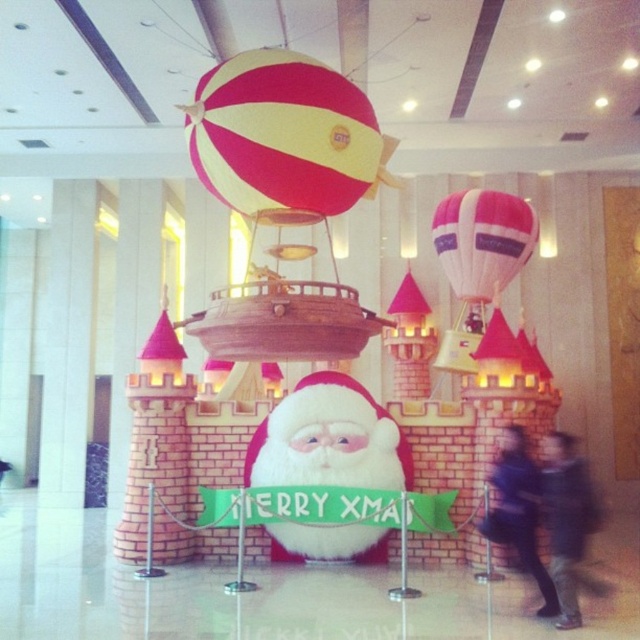
Question: Can you confirm if yellow and red striped balloon at upper center is positioned above pink fabric balloon at center?

Choices:
 (A) no
 (B) yes

Answer: (B)

Question: Which object is closer to the camera taking this photo?

Choices:
 (A) pink fabric balloon at center
 (B) dark blue fabric coat at lower right
 (C) fluffy white santa at center

Answer: (B)

Question: Does pink fabric balloon at center have a greater width compared to dark blue fabric coat at lower right?

Choices:
 (A) no
 (B) yes

Answer: (B)

Question: From the image, what is the correct spatial relationship of pink fabric balloon at center in relation to dark blue jacket at lower right?

Choices:
 (A) right
 (B) left

Answer: (A)

Question: Which point is farther to the camera?

Choices:
 (A) yellow and red striped balloon at upper center
 (B) fluffy white santa at center
 (C) dark blue fabric coat at lower right
 (D) dark blue jacket at lower right

Answer: (B)

Question: Considering the real-world distances, which object is farthest from the fluffy white santa at center?

Choices:
 (A) pink fabric balloon at center
 (B) yellow and red striped balloon at upper center
 (C) dark blue fabric coat at lower right

Answer: (A)